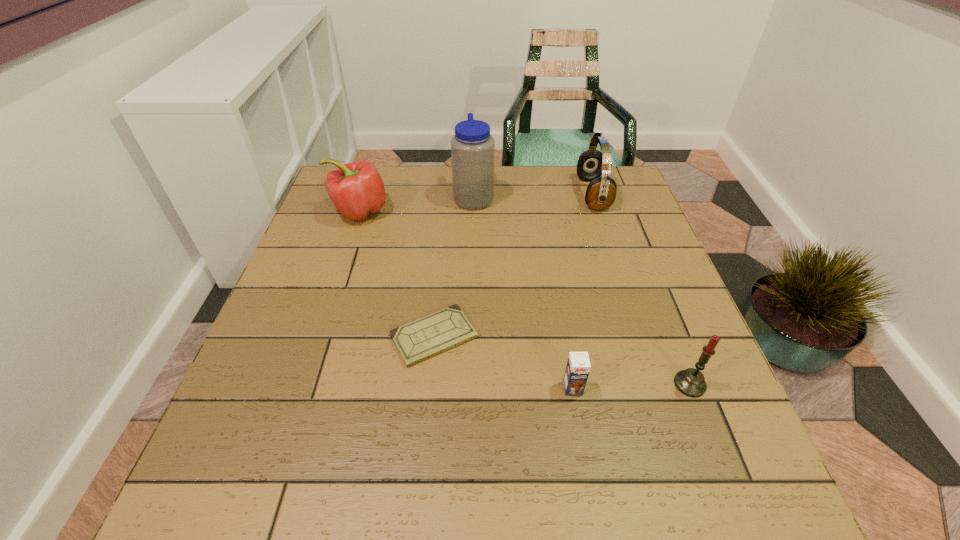
This screenshot has width=960, height=540. Find the location of `headset located in the right edge section of the desktop`. headset located in the right edge section of the desktop is located at coordinates (601, 192).

This screenshot has width=960, height=540. In order to click on candle located in the right edge section of the desktop in this screenshot , I will do `click(691, 382)`.

Image resolution: width=960 pixels, height=540 pixels. Find the location of `object at the far left corner`. object at the far left corner is located at coordinates (356, 189).

Locate an element on the screen. object that is at the far right corner is located at coordinates (601, 192).

Where is `vacant space at the far edge of the desktop`? vacant space at the far edge of the desktop is located at coordinates (434, 172).

In the image, there is a desktop. At what (x,y) coordinates should I click in order to perform the action: click on vacant space at the near edge. Please return your answer as a coordinate pair (x, y). The image size is (960, 540). Looking at the image, I should click on (434, 487).

Identify the location of vacant area at the left edge of the desktop. (236, 403).

Identify the location of free space at the right edge of the desktop. The width and height of the screenshot is (960, 540). (665, 408).

Locate an element on the screen. This screenshot has height=540, width=960. vacant space at the near right corner of the desktop is located at coordinates 708,510.

Where is `free space between the tallest object and the bell pepper`? This screenshot has width=960, height=540. free space between the tallest object and the bell pepper is located at coordinates (417, 204).